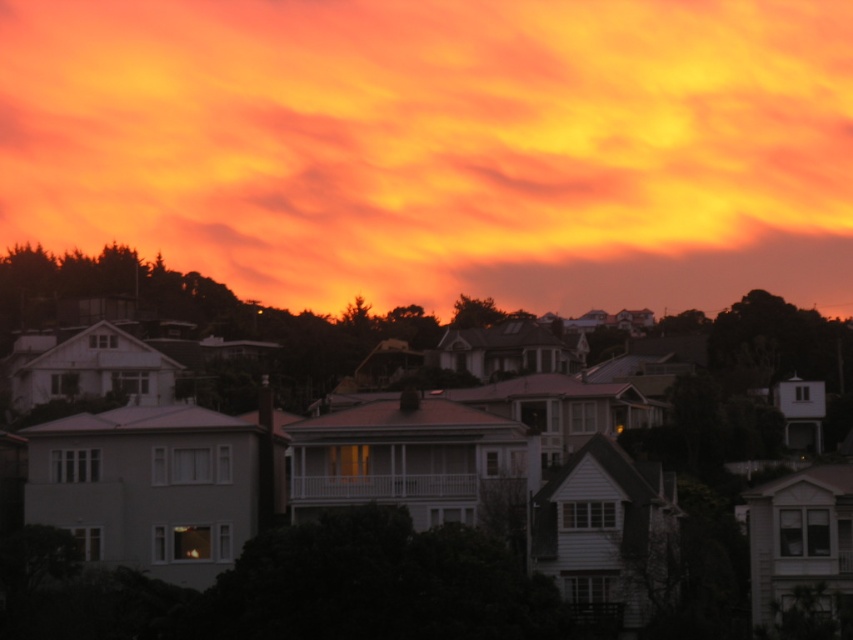
Question: Among these points, which one is farthest from the camera?

Choices:
 (A) (444, 164)
 (B) (744, 324)

Answer: (A)

Question: From the image, what is the correct spatial relationship of orange/yellow cloud at upper center in relation to white matte house at center?

Choices:
 (A) below
 (B) above

Answer: (B)

Question: Which of the following is the farthest from the observer?

Choices:
 (A) white matte house at center
 (B) orange/yellow cloud at upper center

Answer: (B)

Question: Does orange/yellow cloud at upper center come in front of white matte house at center?

Choices:
 (A) yes
 (B) no

Answer: (B)

Question: Can you confirm if orange/yellow cloud at upper center is bigger than white matte house at center?

Choices:
 (A) no
 (B) yes

Answer: (B)